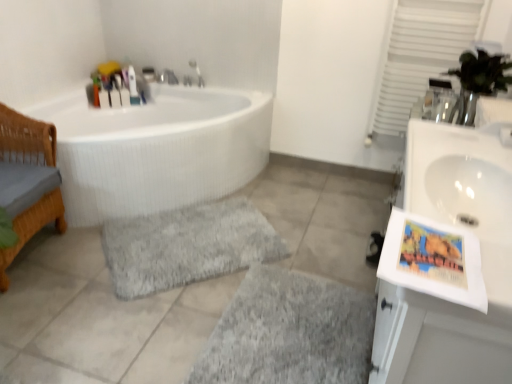
Question: Is white glossy bathtub at left wider or thinner than woven wood basket at left?

Choices:
 (A) thin
 (B) wide

Answer: (B)

Question: Is white glossy bathtub at left bigger or smaller than woven wood basket at left?

Choices:
 (A) big
 (B) small

Answer: (A)

Question: Estimate the real-world distances between objects in this image. Which object is farther from the white glossy bathtub at left?

Choices:
 (A) translucent plastic bottles at upper left, which appears as the 1th toiletry when viewed from the left
 (B) woven wood basket at left
 (C) gray shaggy rug at center, which is counted as the second bath mat, starting from the top
 (D) matte plastic toothbrush at upper left, the first toiletry positioned from the right
 (E) matte silver faucet at upper center

Answer: (C)

Question: Based on their relative distances, which object is farther from the white glossy sink at right?

Choices:
 (A) white glossy bathtub at left
 (B) woven wood basket at left
 (C) gray shaggy bath mat at center, the first bath mat positioned from the top
 (D) matte plastic bottle at upper left, which is the second toiletry in left-to-right order
 (E) gray shaggy rug at center, arranged as the first bath mat when ordered from the bottom

Answer: (D)